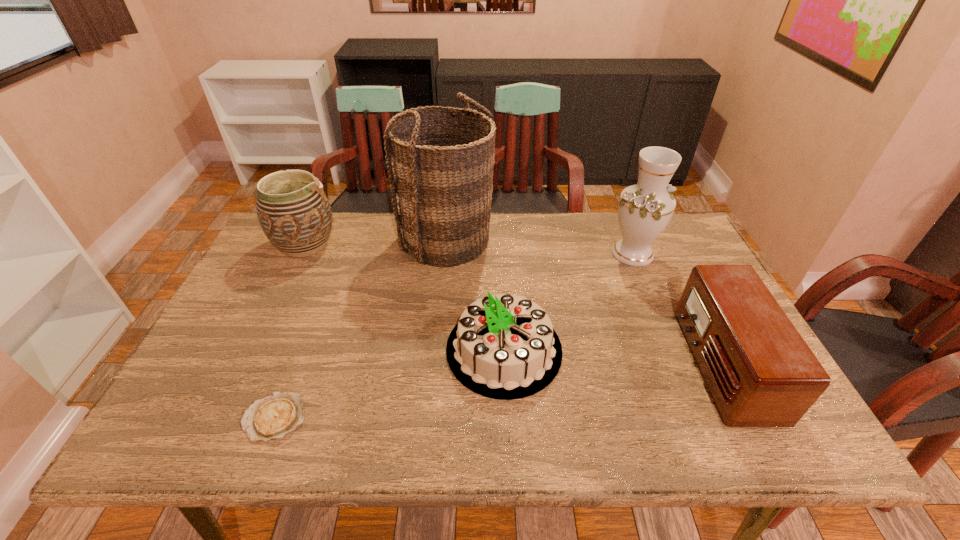
What are the coordinates of `vase positioned at the right edge` in the screenshot? It's located at (644, 210).

The image size is (960, 540). Find the location of `radio receiver positioned at the right edge`. radio receiver positioned at the right edge is located at coordinates (761, 373).

At what (x,y) coordinates should I click in order to perform the action: click on object that is at the far left corner. Please return your answer as a coordinate pair (x, y). This screenshot has width=960, height=540. Looking at the image, I should click on (293, 210).

At what (x,y) coordinates should I click in order to perform the action: click on object at the far right corner. Please return your answer as a coordinate pair (x, y). Looking at the image, I should click on (644, 210).

The width and height of the screenshot is (960, 540). What are the coordinates of `object that is at the near right corner` in the screenshot? It's located at (761, 373).

This screenshot has width=960, height=540. In order to click on free space at the far edge in this screenshot , I will do `click(570, 222)`.

The width and height of the screenshot is (960, 540). I want to click on blank space at the near edge, so click(567, 422).

Identify the location of blank area at the left edge. (268, 271).

Find the location of `vacant space at the near left corner of the desktop`. vacant space at the near left corner of the desktop is located at coordinates (175, 447).

At what (x,y) coordinates should I click in order to perform the action: click on vacant position at the far right corner of the desktop. Please return your answer as a coordinate pair (x, y). Image resolution: width=960 pixels, height=540 pixels. Looking at the image, I should click on (682, 245).